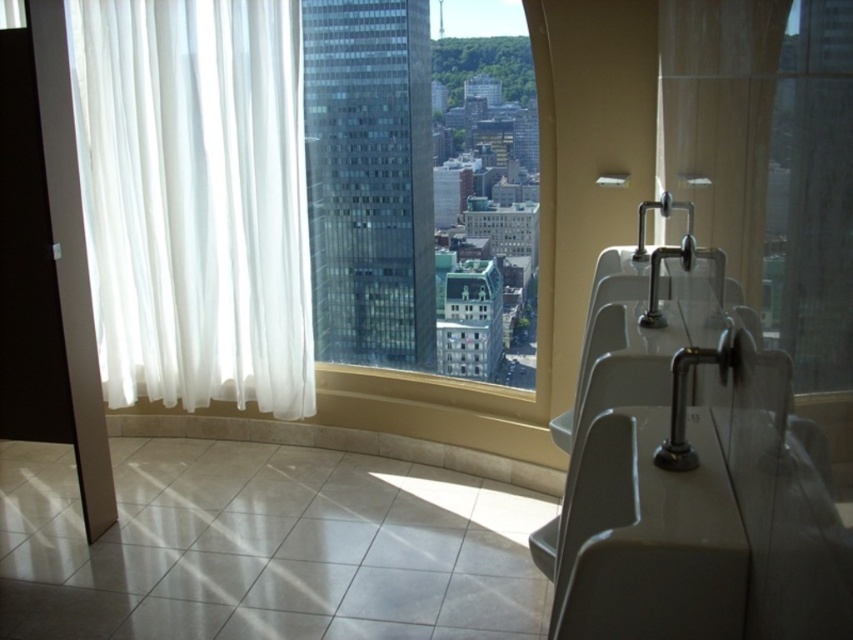
Does white sheer curtain at left appear on the right side of gray matte sink at right?

In fact, white sheer curtain at left is to the left of gray matte sink at right.

Does white sheer curtain at left lie in front of gray matte sink at right?

No, it is behind gray matte sink at right.

Who is more forward, (212, 51) or (697, 433)?

Point (697, 433) is in front.

The width and height of the screenshot is (853, 640). I want to click on white sheer curtain at left, so click(195, 198).

Between point (126, 228) and point (497, 326), which one is positioned behind?

Point (497, 326)

Is white sheer curtain at left bigger than transparent glass window at center?

Incorrect, white sheer curtain at left is not larger than transparent glass window at center.

Who is more distant from viewer, (178, 196) or (329, 88)?

The point (329, 88) is behind.

Where is `white sheer curtain at left`? white sheer curtain at left is located at coordinates (195, 198).

Who is more distant from viewer, (x=496, y=80) or (x=695, y=593)?

Point (x=496, y=80)

Can you confirm if transparent glass window at center is thinner than gray matte sink at right?

No, transparent glass window at center is not thinner than gray matte sink at right.

Who is more forward, (x=373, y=154) or (x=691, y=424)?

Point (x=691, y=424)

At what (x,y) coordinates should I click in order to perform the action: click on transparent glass window at center. Please return your answer as a coordinate pair (x, y). This screenshot has width=853, height=640. Looking at the image, I should click on (422, 186).